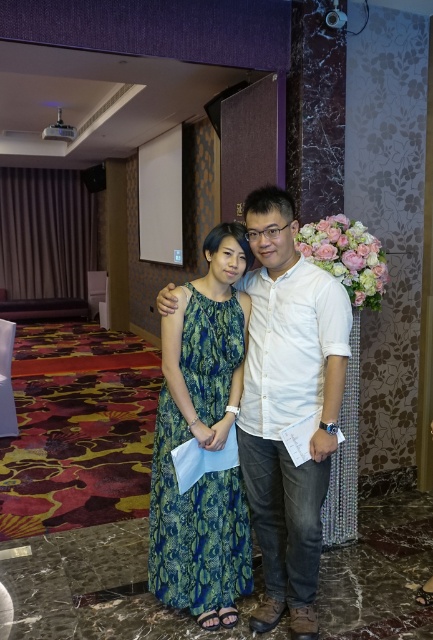
Can you confirm if white cotton shirt at center is smaller than green snakeskin dress at center?

No.

Find the location of `white cotton shirt at center`. white cotton shirt at center is located at coordinates (288, 404).